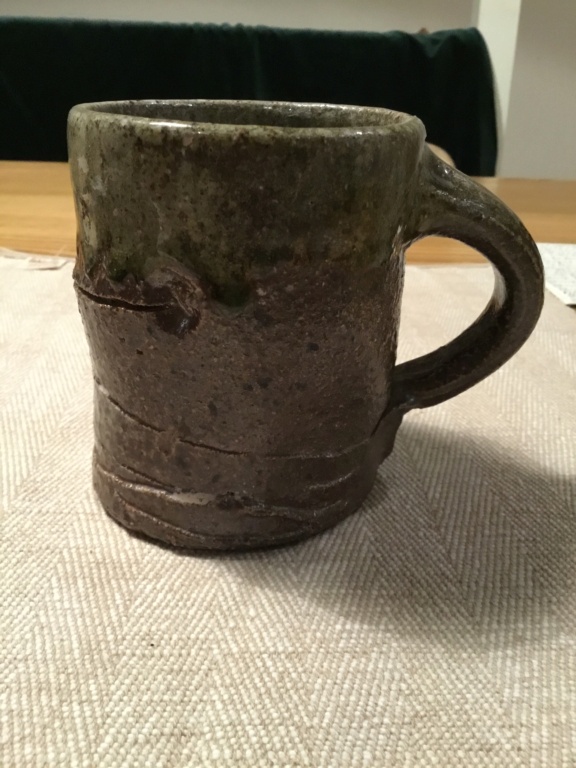
The width and height of the screenshot is (576, 768). What are the coordinates of `wall` in the screenshot? It's located at (539, 97).